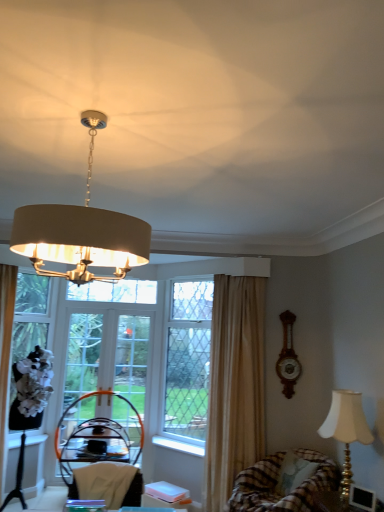
Question: Relative to beige fabric curtain at center, is white glass screen door at center, which is the 2th screen door in right-to-left order, in front or behind?

Choices:
 (A) behind
 (B) front

Answer: (A)

Question: Considering the positions of white glass screen door at center, which is the 2th screen door in right-to-left order, and beige fabric curtain at center in the image, is white glass screen door at center, which is the 2th screen door in right-to-left order, wider or thinner than beige fabric curtain at center?

Choices:
 (A) wide
 (B) thin

Answer: (B)

Question: Considering the real-world distances, which object is closest to the white fabric armchair at lower center, the 2th armchair in the back-to-front sequence?

Choices:
 (A) black woven armchair at center, the second armchair positioned from the top
 (B) wooden clock at right
 (C) gold metallic lampshade at lower right, the 2th lamp in the front-to-back sequence
 (D) clear glass window screen at left, the second window screen positioned from the right
 (E) clear glass window screen at center, marked as the second window screen in a left-to-right arrangement

Answer: (C)

Question: Estimate the real-world distances between objects in this image. Which object is closer to the clear glass door at center, which is the first screen door from right to left?

Choices:
 (A) clear glass window screen at center, acting as the 1th window screen starting from the right
 (B) clear glass window screen at left, the second window screen positioned from the right
 (C) white glass screen door at center, which is the 2th screen door in right-to-left order
 (D) white wood window sill at lower left, the 1th window sill in the left-to-right sequence
 (E) matte beige lampshade at upper center, which is the 2th lamp in back-to-front order

Answer: (C)